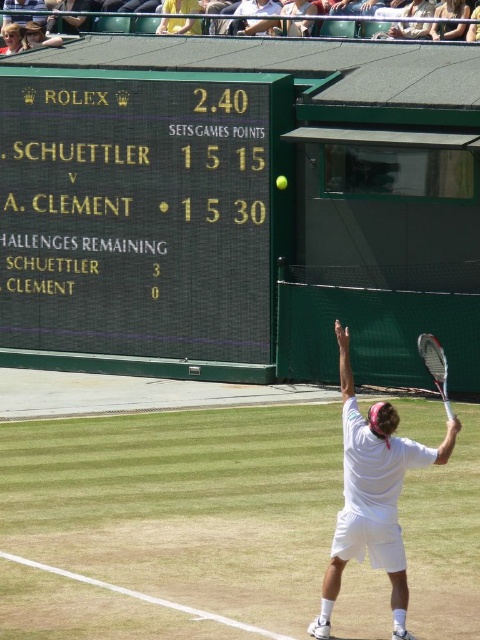
Between white matte tennis racket at upper right and matte black tennis racket at upper right, which one appears on the right side from the viewer's perspective?

From the viewer's perspective, matte black tennis racket at upper right appears more on the right side.

Find the location of a particular element. The image size is (480, 640). white matte tennis racket at upper right is located at coordinates (377, 484).

Locate an element on the screen. The image size is (480, 640). white matte tennis racket at upper right is located at coordinates (377, 484).

Image resolution: width=480 pixels, height=640 pixels. Identify the location of green matte scoreboard at upper left. (141, 221).

Does green matte scoreboard at upper left have a lesser width compared to yellow rubber tennis ball at center?

No, green matte scoreboard at upper left is not thinner than yellow rubber tennis ball at center.

Where is `green matte scoreboard at upper left`? The height and width of the screenshot is (640, 480). green matte scoreboard at upper left is located at coordinates (141, 221).

The height and width of the screenshot is (640, 480). What are the coordinates of `green matte scoreboard at upper left` in the screenshot? It's located at (141, 221).

Who is positioned more to the left, green matte scoreboard at upper left or white matte tennis racket at upper right?

Positioned to the left is green matte scoreboard at upper left.

Is green matte scoreboard at upper left closer to the viewer compared to white matte tennis racket at upper right?

No.

Is point (88, 102) closer to camera compared to point (355, 525)?

No, it is behind (355, 525).

This screenshot has width=480, height=640. Find the location of `green matte scoreboard at upper left`. green matte scoreboard at upper left is located at coordinates (141, 221).